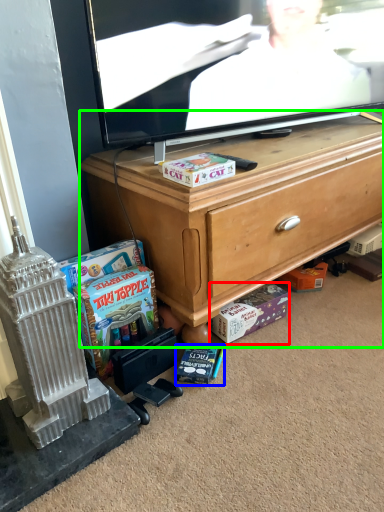
Question: Which is nearer to the cash (highlighted by a red box)? book (highlighted by a blue box) or cabinetry (highlighted by a green box).

Choices:
 (A) book
 (B) cabinetry

Answer: (A)